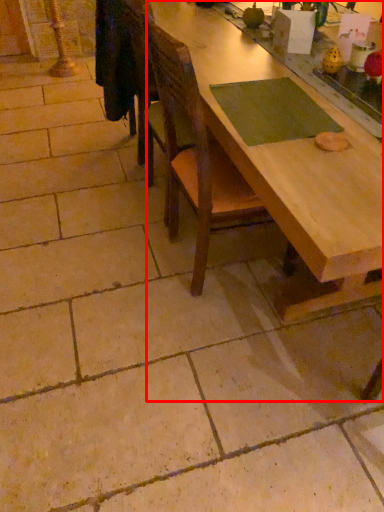
Question: From the image's perspective, considering the relative positions of table (annotated by the red box) and chair in the image provided, where is table (annotated by the red box) located with respect to the staircase?

Choices:
 (A) below
 (B) above

Answer: (B)